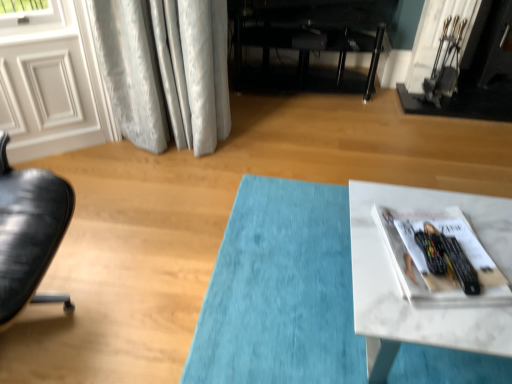
Locate an element on the screen. The image size is (512, 384). free space below black metal fireplace at upper right (from a real-world perspective) is located at coordinates click(x=430, y=99).